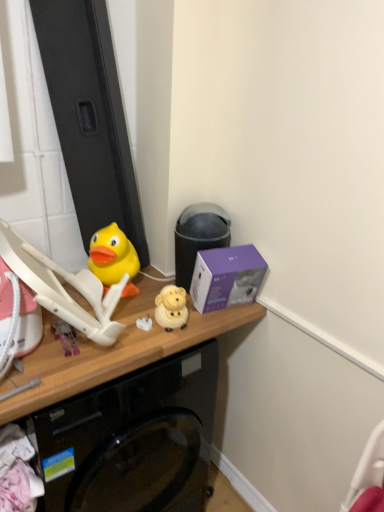
Identify the location of yellow matte sheep at center, which is the 1th toy in right-to-left order. The image size is (384, 512). (171, 308).

Describe the element at coordinates (171, 308) in the screenshot. Image resolution: width=384 pixels, height=512 pixels. I see `yellow matte sheep at center, which is the 1th toy in right-to-left order` at that location.

Image resolution: width=384 pixels, height=512 pixels. I want to click on wooden desk at center, so click(112, 351).

Describe the element at coordinates (198, 237) in the screenshot. The image size is (384, 512). I see `matte black trash can at center` at that location.

Locate an element on the screen. yellow rubber duck at left, positioned as the second toy in left-to-right order is located at coordinates (113, 258).

Considering their positions, is purple matte box at upper right located in front of or behind yellow matte sheep at center, marked as the fourth toy in a left-to-right arrangement?

purple matte box at upper right is positioned farther from the viewer than yellow matte sheep at center, marked as the fourth toy in a left-to-right arrangement.

From a real-world perspective, is purple matte box at upper right below yellow matte sheep at center, marked as the fourth toy in a left-to-right arrangement?

Actually, purple matte box at upper right is physically above yellow matte sheep at center, marked as the fourth toy in a left-to-right arrangement, in the real world.

Is there a large distance between purple matte box at upper right and yellow matte sheep at center, which is the 1th toy in right-to-left order?

purple matte box at upper right is actually quite close to yellow matte sheep at center, which is the 1th toy in right-to-left order.

Does purple matte box at upper right have a lesser width compared to yellow matte sheep at center, which is the 1th toy in right-to-left order?

Incorrect, the width of purple matte box at upper right is not less than that of yellow matte sheep at center, which is the 1th toy in right-to-left order.

Which object is thinner, purple matte box at upper right or wooden desk at center?

purple matte box at upper right.

Is purple matte box at upper right touching wooden desk at center?

No, purple matte box at upper right is not making contact with wooden desk at center.

Is point (229, 266) less distant than point (87, 353)?

No, it is not.

From a real-world perspective, is purple matte box at upper right under wooden desk at center?

Actually, purple matte box at upper right is physically above wooden desk at center in the real world.

From the image's perspective, which one is positioned lower, yellow matte sheep at center, which is the 1th toy in right-to-left order, or matte black trash can at center?

yellow matte sheep at center, which is the 1th toy in right-to-left order.

Can you tell me how much yellow matte sheep at center, which is the 1th toy in right-to-left order, and matte black trash can at center differ in facing direction?

The facing directions of yellow matte sheep at center, which is the 1th toy in right-to-left order, and matte black trash can at center are 15.9 degrees apart.

Which is in front, yellow matte sheep at center, marked as the fourth toy in a left-to-right arrangement, or matte black trash can at center?

yellow matte sheep at center, marked as the fourth toy in a left-to-right arrangement, is closer to the camera.

From a real-world perspective, is yellow matte sheep at center, which is the 1th toy in right-to-left order, positioned over pink plastic toy at lower left, positioned as the fourth toy in right-to-left order, based on gravity?

Yes, from a real-world perspective, yellow matte sheep at center, which is the 1th toy in right-to-left order, is over pink plastic toy at lower left, positioned as the fourth toy in right-to-left order

Could you measure the distance between yellow matte sheep at center, marked as the fourth toy in a left-to-right arrangement, and pink plastic toy at lower left, positioned as the fourth toy in right-to-left order?

The distance of yellow matte sheep at center, marked as the fourth toy in a left-to-right arrangement, from pink plastic toy at lower left, positioned as the fourth toy in right-to-left order, is 10.93 inches.

Is yellow matte sheep at center, which is the 1th toy in right-to-left order, positioned behind pink plastic toy at lower left, positioned as the fourth toy in right-to-left order?

Yes, the depth of yellow matte sheep at center, which is the 1th toy in right-to-left order, is greater than that of pink plastic toy at lower left, positioned as the fourth toy in right-to-left order.

Is yellow matte sheep at center, marked as the fourth toy in a left-to-right arrangement, facing towards pink plastic toy at lower left, the 1th toy viewed from the left?

No, yellow matte sheep at center, marked as the fourth toy in a left-to-right arrangement, is not facing towards pink plastic toy at lower left, the 1th toy viewed from the left.

From the picture: From a real-world perspective, is pink plastic toy at lower left, positioned as the fourth toy in right-to-left order, located higher than yellow matte sheep at center, marked as the fourth toy in a left-to-right arrangement?

No.

From the image's perspective, is pink plastic toy at lower left, the 1th toy viewed from the left, on top of yellow matte sheep at center, marked as the fourth toy in a left-to-right arrangement?

Actually, pink plastic toy at lower left, the 1th toy viewed from the left, appears below yellow matte sheep at center, marked as the fourth toy in a left-to-right arrangement, in the image.

Is pink plastic toy at lower left, positioned as the fourth toy in right-to-left order, wider or thinner than yellow matte sheep at center, which is the 1th toy in right-to-left order?

Considering their sizes, pink plastic toy at lower left, positioned as the fourth toy in right-to-left order, looks broader than yellow matte sheep at center, which is the 1th toy in right-to-left order.

From the picture: Can you confirm if wooden desk at center is shorter than yellow rubber duck at left, which is counted as the third toy, starting from the right?

Incorrect, the height of wooden desk at center does not fall short of that of yellow rubber duck at left, which is counted as the third toy, starting from the right.

Is wooden desk at center facing towards yellow rubber duck at left, positioned as the second toy in left-to-right order?

No.

Could yellow rubber duck at left, positioned as the second toy in left-to-right order, be considered to be inside wooden desk at center?

No, yellow rubber duck at left, positioned as the second toy in left-to-right order, is not a part of wooden desk at center.

Which of these two, wooden desk at center or yellow rubber duck at left, which is counted as the third toy, starting from the right, is bigger?

With larger size is wooden desk at center.

Is matte black trash can at center located outside pink plastic toy at lower left, the 1th toy viewed from the left?

Indeed, matte black trash can at center is completely outside pink plastic toy at lower left, the 1th toy viewed from the left.

Does point (195, 233) come in front of point (59, 331)?

No, it is behind (59, 331).

Which object is further away from the camera taking this photo, matte black trash can at center or pink plastic toy at lower left, the 1th toy viewed from the left?

matte black trash can at center is further from the camera.

Where is `the 1st toy to the left of the purple matte box at upper right, starting your count from the anchor`? Image resolution: width=384 pixels, height=512 pixels. the 1st toy to the left of the purple matte box at upper right, starting your count from the anchor is located at coordinates (171, 308).

Image resolution: width=384 pixels, height=512 pixels. What are the coordinates of `desk beneath the purple matte box at upper right (from a real-world perspective)` in the screenshot? It's located at (112, 351).

When comparing their distances from yellow matte sheep at center, marked as the fourth toy in a left-to-right arrangement, does yellow rubber duck at left, positioned as the second toy in left-to-right order, or white matte plug at center, which is the 2th toy from right to left, seem closer?

white matte plug at center, which is the 2th toy from right to left, lies closer to yellow matte sheep at center, marked as the fourth toy in a left-to-right arrangement, than the other object.

Looking at the image, which one is located further to white matte plug at center, which appears as the third toy when viewed from the left, matte black trash can at center or yellow matte sheep at center, marked as the fourth toy in a left-to-right arrangement?

matte black trash can at center is positioned further to the anchor white matte plug at center, which appears as the third toy when viewed from the left.

Considering their positions, is yellow matte sheep at center, marked as the fourth toy in a left-to-right arrangement, positioned closer to white matte plug at center, which is the 2th toy from right to left, than pink plastic toy at lower left, positioned as the fourth toy in right-to-left order?

yellow matte sheep at center, marked as the fourth toy in a left-to-right arrangement, is closer to white matte plug at center, which is the 2th toy from right to left.

Looking at the image, which one is located further to yellow matte sheep at center, marked as the fourth toy in a left-to-right arrangement, pink plastic toy at lower left, positioned as the fourth toy in right-to-left order, or purple matte box at upper right?

pink plastic toy at lower left, positioned as the fourth toy in right-to-left order, is positioned further to the anchor yellow matte sheep at center, marked as the fourth toy in a left-to-right arrangement.

Which object lies further to the anchor point purple matte box at upper right, wooden desk at center or white matte plug at center, which appears as the third toy when viewed from the left?

white matte plug at center, which appears as the third toy when viewed from the left, lies further to purple matte box at upper right than the other object.

Looking at the image, which one is located closer to matte black trash can at center, yellow rubber duck at left, positioned as the second toy in left-to-right order, or purple matte box at upper right?

purple matte box at upper right is positioned closer to the anchor matte black trash can at center.

From the image, which object appears to be nearer to wooden desk at center, pink plastic toy at lower left, the 1th toy viewed from the left, or matte black trash can at center?

pink plastic toy at lower left, the 1th toy viewed from the left, is closer to wooden desk at center.

Based on their spatial positions, is white matte plug at center, which is the 2th toy from right to left, or wooden desk at center further from matte black trash can at center?

Based on the image, white matte plug at center, which is the 2th toy from right to left, appears to be further to matte black trash can at center.

The height and width of the screenshot is (512, 384). In order to click on trash bin/can between pink plastic toy at lower left, positioned as the fourth toy in right-to-left order, and purple matte box at upper right, in the horizontal direction in this screenshot , I will do `click(198, 237)`.

Locate an element on the screen. Image resolution: width=384 pixels, height=512 pixels. trash bin/can between white matte plug at center, which appears as the third toy when viewed from the left, and purple matte box at upper right is located at coordinates (198, 237).

This screenshot has height=512, width=384. I want to click on toy located between white matte plug at center, which is the 2th toy from right to left, and purple matte box at upper right in the left-right direction, so click(x=171, y=308).

You are a GUI agent. You are given a task and a screenshot of the screen. Output one action in this format:
    pyautogui.click(x=<x>, y=<y>)
    Task: Click on the toy between white matte plug at center, which is the 2th toy from right to left, and wooden desk at center vertically
    This screenshot has width=384, height=512.
    Given the screenshot: What is the action you would take?
    pyautogui.click(x=65, y=337)